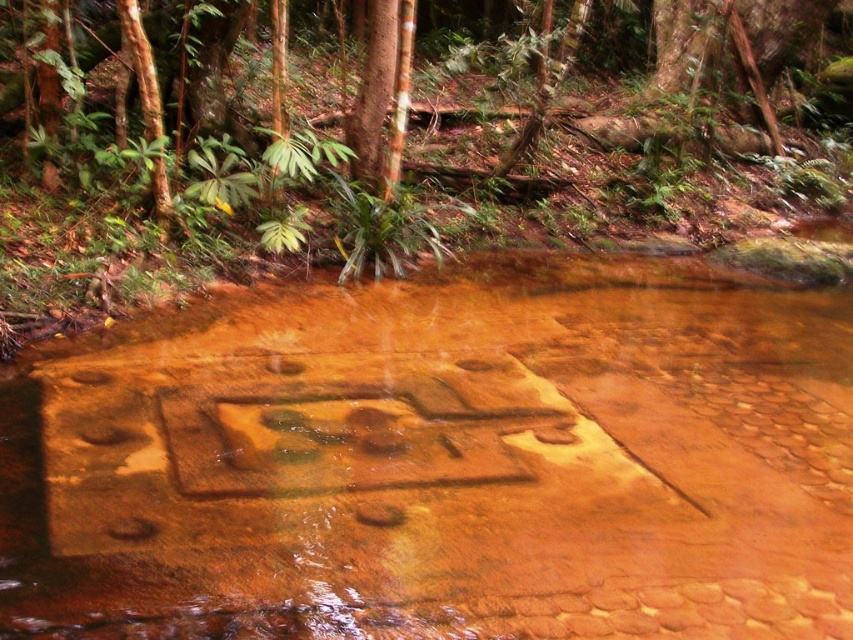
Question: Can you confirm if brown textured mud at center is smaller than brown stone forest at center?

Choices:
 (A) yes
 (B) no

Answer: (A)

Question: Considering the relative positions of brown textured mud at center and brown stone forest at center in the image provided, where is brown textured mud at center located with respect to brown stone forest at center?

Choices:
 (A) left
 (B) right

Answer: (A)

Question: Can you confirm if brown textured mud at center is positioned above brown stone forest at center?

Choices:
 (A) no
 (B) yes

Answer: (A)